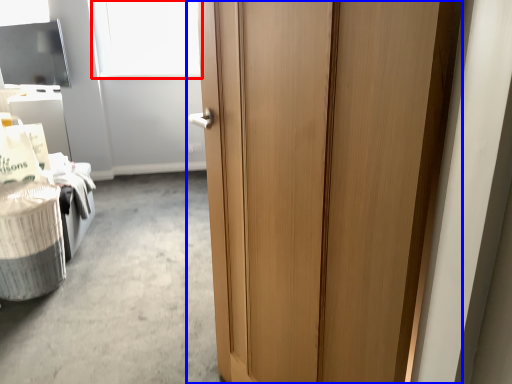
Question: Which object is closer to the camera taking this photo, window screen (highlighted by a red box) or door (highlighted by a blue box)?

Choices:
 (A) window screen
 (B) door

Answer: (B)